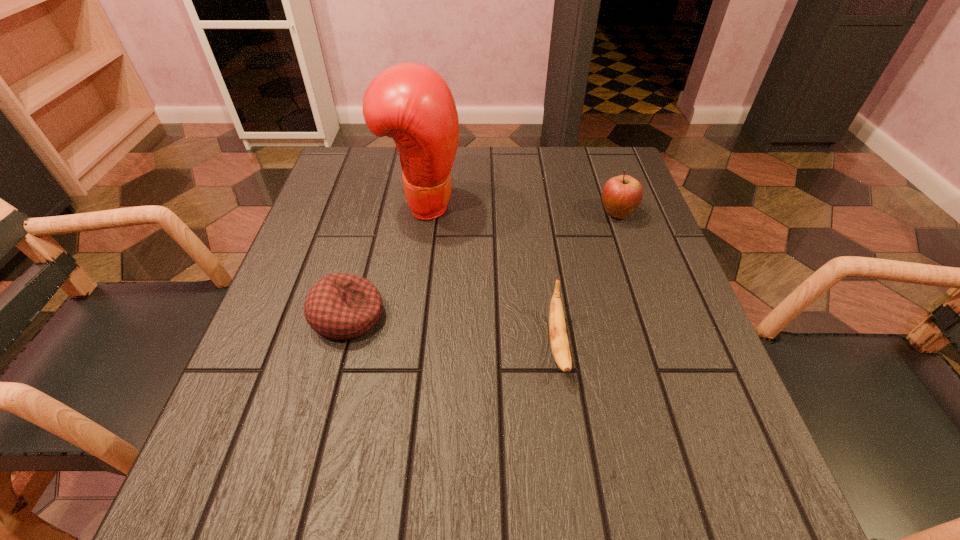
Select which object appears as the closest to the third shortest object. Please provide its 2D coordinates. Your answer should be formatted as a tuple, i.e. [(x, y)], where the tuple contains the x and y coordinates of a point satisfying the conditions above.

[(557, 328)]

You are a GUI agent. You are given a task and a screenshot of the screen. Output one action in this format:
    pyautogui.click(x=<x>, y=<y>)
    Task: Click on the vacant area that satisfies the following two spatial constraints: 1. on the striking surface of the tallest object; 2. on the left side of the rightmost object
    The image size is (960, 540).
    Given the screenshot: What is the action you would take?
    pyautogui.click(x=421, y=214)

The height and width of the screenshot is (540, 960). Find the location of `free space that satisfies the following two spatial constraints: 1. on the back side of the apple; 2. on the striking surface of the tallest object`. free space that satisfies the following two spatial constraints: 1. on the back side of the apple; 2. on the striking surface of the tallest object is located at coordinates (613, 204).

Image resolution: width=960 pixels, height=540 pixels. What are the coordinates of `free spot that satisfies the following two spatial constraints: 1. on the striking surface of the second tallest object; 2. on the left side of the tallest object` in the screenshot? It's located at (421, 214).